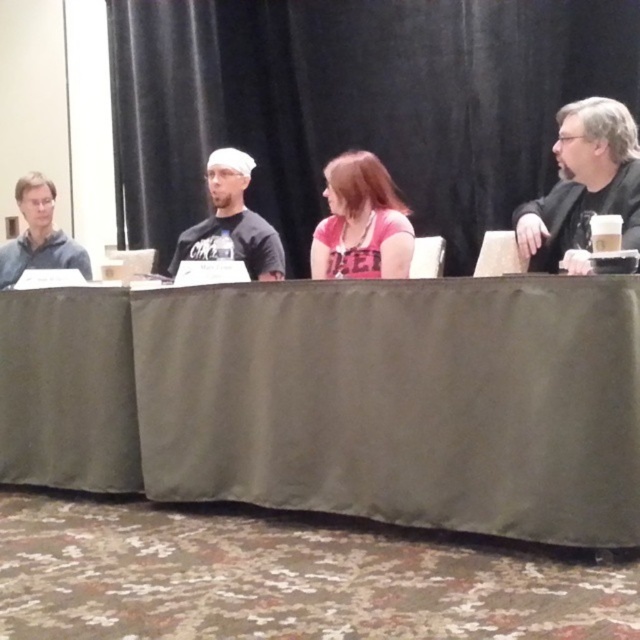
Is matte black jacket at right smaller than matte black shirt at center?

Yes.

Is matte black jacket at right below matte black shirt at center?

Yes.

Who is more distant from viewer, (589, 108) or (221, 188)?

Positioned behind is point (221, 188).

Where is `matte black jacket at right`? The width and height of the screenshot is (640, 640). matte black jacket at right is located at coordinates (582, 186).

Can you confirm if green fabric table at center is bigger than matte gray shirt at left?

Yes.

Does green fabric table at center have a greater width compared to matte gray shirt at left?

Yes.

This screenshot has height=640, width=640. What do you see at coordinates (339, 400) in the screenshot?
I see `green fabric table at center` at bounding box center [339, 400].

Image resolution: width=640 pixels, height=640 pixels. I want to click on green fabric table at center, so click(x=339, y=400).

Does pink fabric shirt at center have a lesser width compared to matte gray shirt at left?

Yes, pink fabric shirt at center is thinner than matte gray shirt at left.

Measure the distance between point (330, 220) and camera.

A distance of 3.14 meters exists between point (330, 220) and camera.

Find the location of `pink fabric shirt at center`. pink fabric shirt at center is located at coordinates (362, 221).